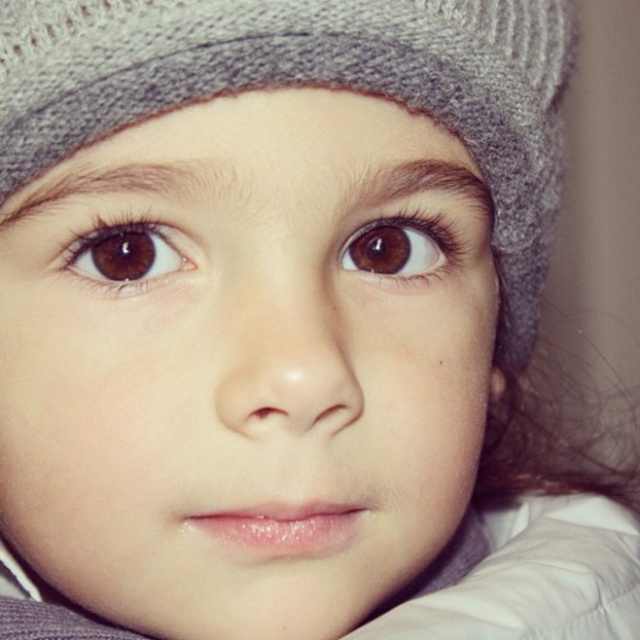
You are a photographer adjusting the focus on a camera. You have two points of interest in the image, point (156, 237) and point (404, 269). Which point is closer to the camera lens?

Point (156, 237) is in front of point (404, 269), so it is closer to the camera lens.

You are a photographer adjusting the focus on a camera lens. You need to ensure both the brown matte eye at upper left and the brown matte eye at upper center are in focus. Given that the depth of field can cover 3 inches, will both eyes be in focus?

The brown matte eye at upper left and brown matte eye at upper center are 3.44 inches apart from each other. Since the depth of field can only cover 3 inches, both eyes cannot be in focus simultaneously.